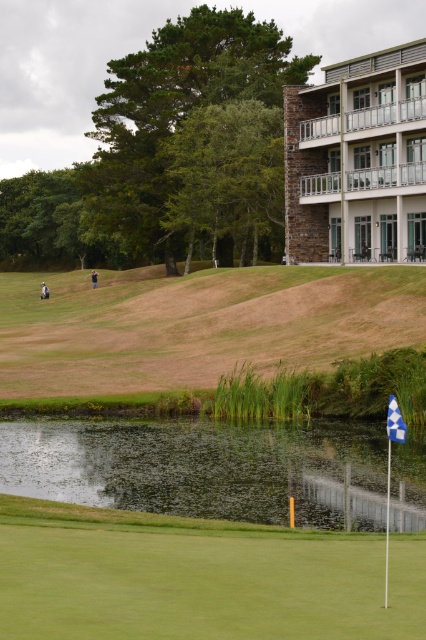
Can you confirm if green grass at lower center is shorter than blue fabric flag at lower right?

Indeed, green grass at lower center has a lesser height compared to blue fabric flag at lower right.

How much distance is there between green grass at lower center and blue fabric flag at lower right?

3.16 meters

Which is behind, point (245, 566) or point (397, 413)?

The point (245, 566) is more distant.

Identify the location of green grass at lower center. (198, 577).

Who is taller, green reflective water at lower center or blue fabric flag at lower right?

blue fabric flag at lower right

Is green reflective water at lower center to the left of blue fabric flag at lower right from the viewer's perspective?

Indeed, green reflective water at lower center is positioned on the left side of blue fabric flag at lower right.

Image resolution: width=426 pixels, height=640 pixels. Identify the location of green reflective water at lower center. (204, 467).

Is stone brick building at upper right further to the viewer compared to blue fabric flag at lower right?

Yes, stone brick building at upper right is behind blue fabric flag at lower right.

Between point (308, 136) and point (388, 396), which one is positioned behind?

The point (308, 136) is more distant.

Which is in front, point (336, 128) or point (388, 432)?

Point (388, 432)

Locate an element on the screen. Image resolution: width=426 pixels, height=640 pixels. stone brick building at upper right is located at coordinates (356, 157).